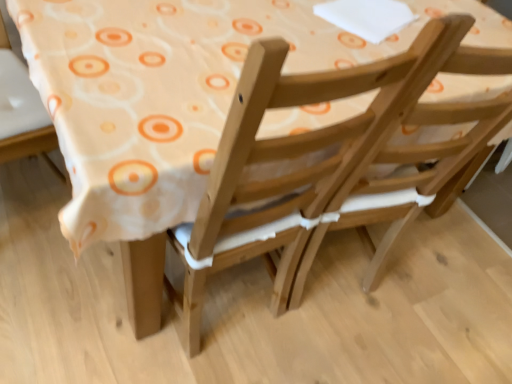
In order to face natural wood chair at center, which ranks as the second chair in left-to-right order, should I rotate leftwards or rightwards?

It's best to rotate left around 3.947 degrees.

The image size is (512, 384). I want to click on natural wood chair at center, acting as the 1th chair starting from the right, so click(292, 157).

The height and width of the screenshot is (384, 512). Describe the element at coordinates (292, 157) in the screenshot. I see `natural wood chair at center, acting as the 1th chair starting from the right` at that location.

This screenshot has width=512, height=384. Describe the element at coordinates (22, 112) in the screenshot. I see `wooden chair at lower left, positioned as the 1th chair in left-to-right order` at that location.

The width and height of the screenshot is (512, 384). In order to click on wooden chair at lower left, arranged as the second chair when viewed from the right in this screenshot , I will do click(x=22, y=112).

Where is `natural wood chair at center, which ranks as the second chair in left-to-right order`? The height and width of the screenshot is (384, 512). natural wood chair at center, which ranks as the second chair in left-to-right order is located at coordinates (292, 157).

Is wooden chair at lower left, positioned as the 1th chair in left-to-right order, at the left side of natural wood chair at center, which ranks as the second chair in left-to-right order?

Indeed, wooden chair at lower left, positioned as the 1th chair in left-to-right order, is positioned on the left side of natural wood chair at center, which ranks as the second chair in left-to-right order.

Relative to natural wood chair at center, acting as the 1th chair starting from the right, is wooden chair at lower left, arranged as the second chair when viewed from the right, in front or behind?

In the image, wooden chair at lower left, arranged as the second chair when viewed from the right, appears behind natural wood chair at center, acting as the 1th chair starting from the right.

Which is farther, (32,118) or (261,192)?

The point (32,118) is farther.

From the image's perspective, who appears lower, wooden chair at lower left, positioned as the 1th chair in left-to-right order, or natural wood chair at center, acting as the 1th chair starting from the right?

natural wood chair at center, acting as the 1th chair starting from the right, appears lower in the image.

From a real-world perspective, is wooden chair at lower left, positioned as the 1th chair in left-to-right order, positioned above or below natural wood chair at center, acting as the 1th chair starting from the right?

From a real-world perspective, wooden chair at lower left, positioned as the 1th chair in left-to-right order, is physically below natural wood chair at center, acting as the 1th chair starting from the right.

Considering the relative sizes of wooden chair at lower left, arranged as the second chair when viewed from the right, and natural wood chair at center, acting as the 1th chair starting from the right, in the image provided, is wooden chair at lower left, arranged as the second chair when viewed from the right, wider than natural wood chair at center, acting as the 1th chair starting from the right,?

Incorrect, the width of wooden chair at lower left, arranged as the second chair when viewed from the right, does not surpass that of natural wood chair at center, acting as the 1th chair starting from the right.

Does wooden chair at lower left, arranged as the second chair when viewed from the right, have a greater height compared to natural wood chair at center, which ranks as the second chair in left-to-right order?

Answer: Incorrect, the height of wooden chair at lower left, arranged as the second chair when viewed from the right, is not larger of that of natural wood chair at center, which ranks as the second chair in left-to-right order.

In terms of size, does wooden chair at lower left, positioned as the 1th chair in left-to-right order, appear bigger or smaller than natural wood chair at center, which ranks as the second chair in left-to-right order?

In the image, wooden chair at lower left, positioned as the 1th chair in left-to-right order, appears to be smaller than natural wood chair at center, which ranks as the second chair in left-to-right order.

Is wooden chair at lower left, positioned as the 1th chair in left-to-right order, positioned beyond the bounds of natural wood chair at center, which ranks as the second chair in left-to-right order?

Absolutely, wooden chair at lower left, positioned as the 1th chair in left-to-right order, is external to natural wood chair at center, which ranks as the second chair in left-to-right order.

Are wooden chair at lower left, arranged as the second chair when viewed from the right, and natural wood chair at center, acting as the 1th chair starting from the right, far apart?

No, there isn't a large distance between wooden chair at lower left, arranged as the second chair when viewed from the right, and natural wood chair at center, acting as the 1th chair starting from the right.

Is wooden chair at lower left, positioned as the 1th chair in left-to-right order, facing away from natural wood chair at center, which ranks as the second chair in left-to-right order?

No, wooden chair at lower left, positioned as the 1th chair in left-to-right order,'s orientation is not away from natural wood chair at center, which ranks as the second chair in left-to-right order.

Can you tell me how much wooden chair at lower left, positioned as the 1th chair in left-to-right order, and natural wood chair at center, which ranks as the second chair in left-to-right order, differ in facing direction?

The angular difference between wooden chair at lower left, positioned as the 1th chair in left-to-right order, and natural wood chair at center, which ranks as the second chair in left-to-right order, is 174 degrees.

Where is `chair behind the natural wood chair at center, acting as the 1th chair starting from the right`? The height and width of the screenshot is (384, 512). chair behind the natural wood chair at center, acting as the 1th chair starting from the right is located at coordinates (22, 112).

Can you confirm if natural wood chair at center, which ranks as the second chair in left-to-right order, is positioned to the left of wooden chair at lower left, positioned as the 1th chair in left-to-right order?

In fact, natural wood chair at center, which ranks as the second chair in left-to-right order, is to the right of wooden chair at lower left, positioned as the 1th chair in left-to-right order.

Is natural wood chair at center, acting as the 1th chair starting from the right, closer to camera compared to wooden chair at lower left, arranged as the second chair when viewed from the right?

Yes, natural wood chair at center, acting as the 1th chair starting from the right, is in front of wooden chair at lower left, arranged as the second chair when viewed from the right.

Between point (234, 144) and point (56, 146), which one is positioned in front?

Positioned in front is point (234, 144).

From the image's perspective, which is above, natural wood chair at center, which ranks as the second chair in left-to-right order, or wooden chair at lower left, arranged as the second chair when viewed from the right?

wooden chair at lower left, arranged as the second chair when viewed from the right.

From a real-world perspective, which object stands above the other?

natural wood chair at center, acting as the 1th chair starting from the right, is physically above.

In terms of width, does natural wood chair at center, acting as the 1th chair starting from the right, look wider or thinner when compared to wooden chair at lower left, arranged as the second chair when viewed from the right?

Considering their sizes, natural wood chair at center, acting as the 1th chair starting from the right, looks broader than wooden chair at lower left, arranged as the second chair when viewed from the right.

Does natural wood chair at center, which ranks as the second chair in left-to-right order, have a lesser height compared to wooden chair at lower left, positioned as the 1th chair in left-to-right order?

Incorrect, the height of natural wood chair at center, which ranks as the second chair in left-to-right order, does not fall short of that of wooden chair at lower left, positioned as the 1th chair in left-to-right order.

Considering the sizes of objects natural wood chair at center, acting as the 1th chair starting from the right, and wooden chair at lower left, arranged as the second chair when viewed from the right, in the image provided, who is bigger, natural wood chair at center, acting as the 1th chair starting from the right, or wooden chair at lower left, arranged as the second chair when viewed from the right,?

natural wood chair at center, acting as the 1th chair starting from the right, is bigger.

Is natural wood chair at center, acting as the 1th chair starting from the right, situated inside wooden chair at lower left, positioned as the 1th chair in left-to-right order, or outside?

natural wood chair at center, acting as the 1th chair starting from the right, is not inside wooden chair at lower left, positioned as the 1th chair in left-to-right order, it's outside.

Is natural wood chair at center, which ranks as the second chair in left-to-right order, touching wooden chair at lower left, positioned as the 1th chair in left-to-right order?

No, natural wood chair at center, which ranks as the second chair in left-to-right order, is not with wooden chair at lower left, positioned as the 1th chair in left-to-right order.

Is natural wood chair at center, acting as the 1th chair starting from the right, positioned with its back to wooden chair at lower left, positioned as the 1th chair in left-to-right order?

No, wooden chair at lower left, positioned as the 1th chair in left-to-right order, is not at the back of natural wood chair at center, acting as the 1th chair starting from the right.

How different are the orientations of natural wood chair at center, acting as the 1th chair starting from the right, and wooden chair at lower left, arranged as the second chair when viewed from the right, in degrees?

The angular difference between natural wood chair at center, acting as the 1th chair starting from the right, and wooden chair at lower left, arranged as the second chair when viewed from the right, is 174 degrees.

How distant is natural wood chair at center, acting as the 1th chair starting from the right, from wooden chair at lower left, arranged as the second chair when viewed from the right?

They are 69.72 centimeters apart.

Locate an element on the screen. Image resolution: width=512 pixels, height=384 pixels. chair that appears above the natural wood chair at center, acting as the 1th chair starting from the right (from the image's perspective) is located at coordinates (22, 112).

This screenshot has width=512, height=384. In the image, there is a natural wood chair at center, which ranks as the second chair in left-to-right order. Find the location of `chair below it (from a real-world perspective)`. chair below it (from a real-world perspective) is located at coordinates (22, 112).

The image size is (512, 384). In the image, there is a wooden chair at lower left, positioned as the 1th chair in left-to-right order. Identify the location of chair below it (from the image's perspective). (292, 157).